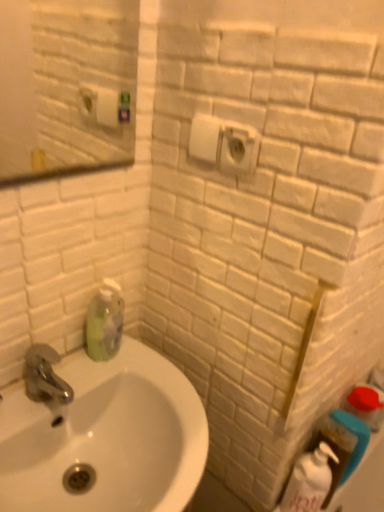
Question: From their relative heights in the image, would you say white glossy sink at lower left is taller or shorter than white glossy bottle at lower right, which is the first cleaning product from right to left?

Choices:
 (A) short
 (B) tall

Answer: (A)

Question: Based on their sizes in the image, would you say white glossy sink at lower left is bigger or smaller than white glossy bottle at lower right, the 2th cleaning product positioned from the left?

Choices:
 (A) small
 (B) big

Answer: (B)

Question: Which object is positioned closest to the white glossy sink at lower left?

Choices:
 (A) white glossy bottle at lower right, positioned as the 1th cleaning product in bottom-to-top order
 (B) white plastic electric outlet at upper center
 (C) green matte bottle at lower left, the 2th cleaning product from the bottom

Answer: (C)

Question: Which of these objects is positioned closest to the white glossy sink at lower left?

Choices:
 (A) green matte bottle at lower left, the 1th cleaning product viewed from the left
 (B) white glossy bottle at lower right, the 2th cleaning product in the top-to-bottom sequence
 (C) white plastic electric outlet at upper center

Answer: (A)